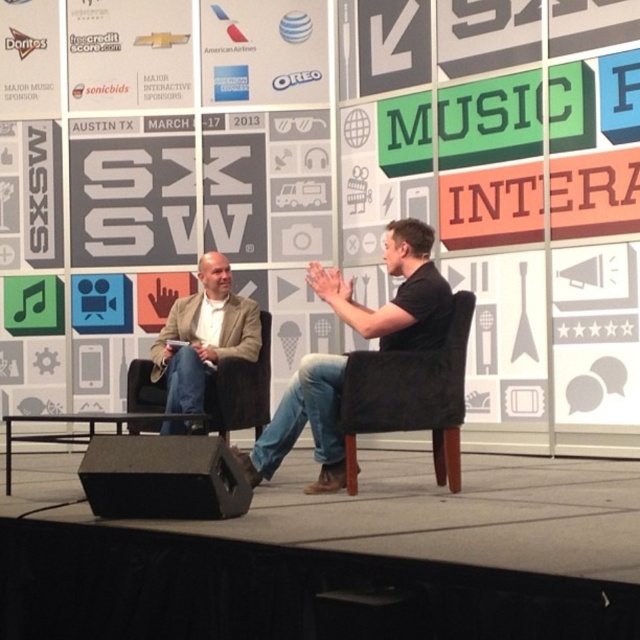
You are an event planner trying to arrange seating for a panel discussion. You have two chairs available on stage, the black leather chair at center and the black fabric armchair at center. Which chair should you choose if you want the speaker to have a higher seat for visibility?

The black leather chair at center is taller than the black fabric armchair at center, so you should choose the black leather chair at center to ensure the speaker has a higher seat for better visibility.

You are a stagehand at SXSW needing to place a 3.5 feet wide banner between the black matte speaker at lower left and the light brown leather jacket at left. Can you fit it there?

The distance between the black matte speaker at lower left and the light brown leather jacket at left is 3.91 feet, so the 3.5 feet wide banner can fit as it is narrower than the available space.

You are an event photographer positioned at the back of the stage. You need to capture a clear photo of both the black leather chair at center and the black matte speaker at lower left. Which object should you focus on first to ensure both are in focus?

You should focus on the black leather chair at center first because it is closer to you than the black matte speaker at lower left, so adjusting focus from near to far will help both be in focus.